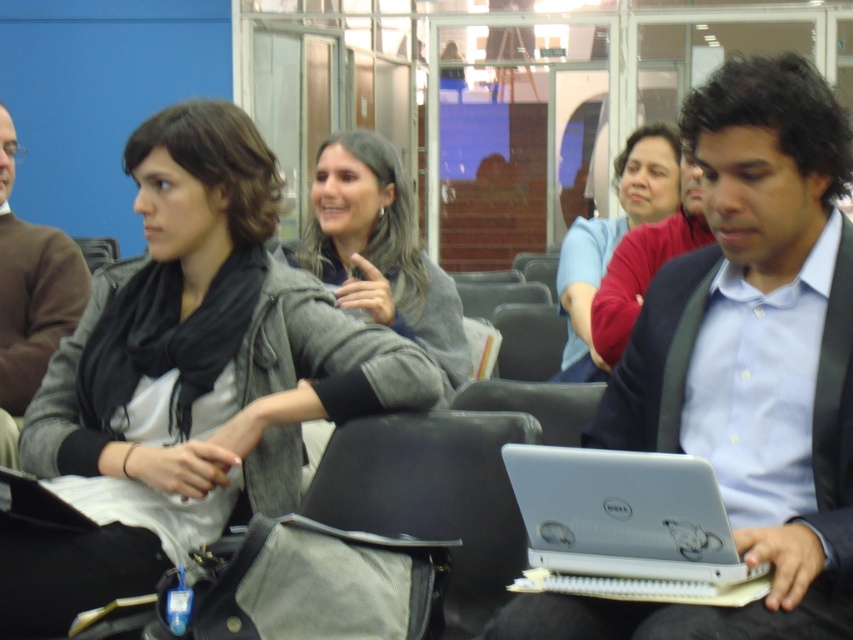
You are organizing a presentation and need to place the matte silver laptop at center and the brown sweater at left on a shelf. Which object should be placed first if you want to arrange them from tallest to shortest?

The matte silver laptop at center should be placed first because it has a greater height compared to the brown sweater at left.

You are a photographer in the conference room. You want to take a photo of the matte silver laptop at center and the matte red sweater at center. Which object is closer to the camera?

The matte silver laptop at center is located below the matte red sweater at center, so it is closer to the camera.